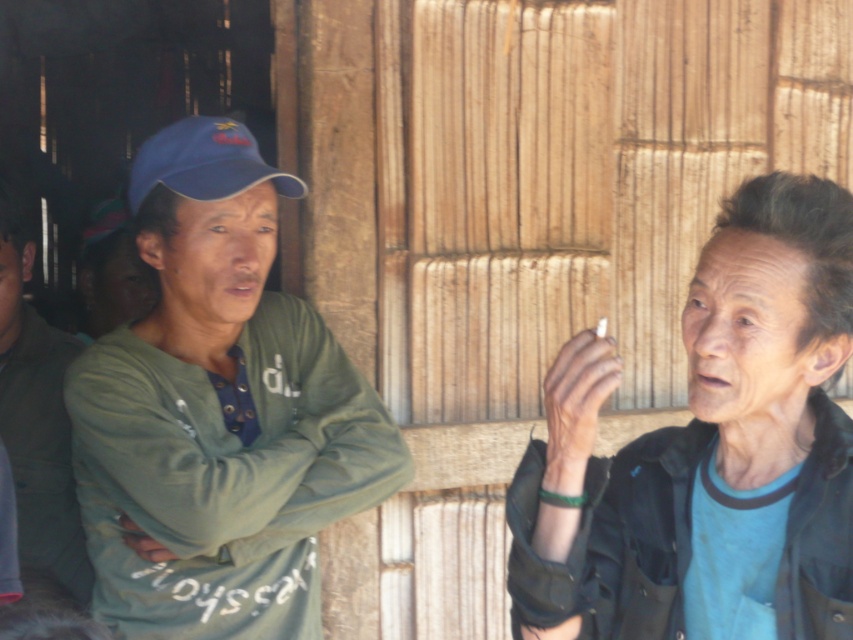
You are a photographer trying to capture a closeup of the two points in the image. The first point is at coordinate point (521,586) and the second point is at coordinate point (235,138). Which point should you focus on first to ensure it appears sharp in the photo?

Point (521,586) is closer to the camera than point (235,138), so you should focus on point (521,586) first to ensure it appears sharp in the photo.

You are a fashion designer observing two green matte garments on a person in the image. The garments are the green matte shirt at left and the green matte jacket at left. Which garment has a greater height measurement?

The green matte shirt at left is taller than the green matte jacket at left according to the description provided.

You are designing a display case for a clothing store. The display case has a shelf that can only hold items wider than 20 cm. You need to place both the green matte shirt at left and the blue fabric baseball cap at upper left on the same shelf. Based on their widths, will both items fit on the shelf?

The green matte shirt at left is wider than the blue fabric baseball cap at upper left. However, since the shelf requires items to be wider than 20 cm, we need to know the exact width of the shirt. If the shirt is wider than 20 cm, both items can fit as long as their combined width doesn